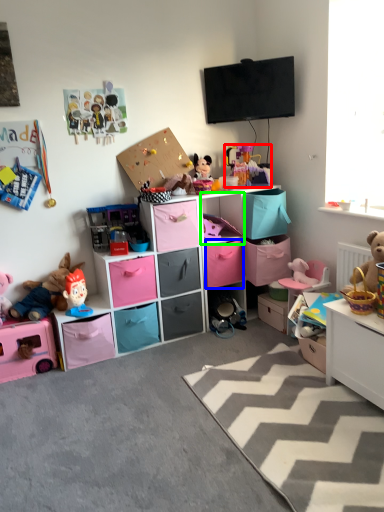
Question: Which object is positioned closest to toy (highlighted by a red box)? Select from drawer (highlighted by a blue box) and cabinet (highlighted by a green box).

Choices:
 (A) drawer
 (B) cabinet

Answer: (B)